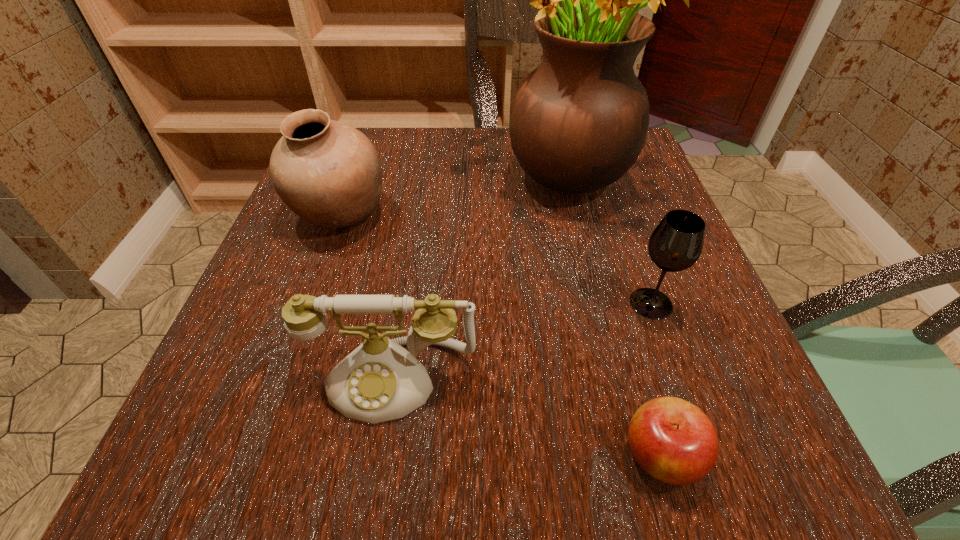
Find the location of a particular element. This screenshot has width=960, height=540. free space between the shortest object and the telephone is located at coordinates (526, 417).

Where is `vacant area that lies between the telephone and the wineglass`? Image resolution: width=960 pixels, height=540 pixels. vacant area that lies between the telephone and the wineglass is located at coordinates (521, 341).

Point out which object is positioned as the nearest to the tallest object. Please provide its 2D coordinates. Your answer should be formatted as a tuple, i.e. [(x, y)], where the tuple contains the x and y coordinates of a point satisfying the conditions above.

[(327, 172)]

Locate which object ranks fourth in proximity to the pottery. Please provide its 2D coordinates. Your answer should be formatted as a tuple, i.e. [(x, y)], where the tuple contains the x and y coordinates of a point satisfying the conditions above.

[(674, 441)]

Where is `vacant area that satisfies the following two spatial constraints: 1. on the dial of the telephone; 2. on the left side of the shortest object`? This screenshot has height=540, width=960. vacant area that satisfies the following two spatial constraints: 1. on the dial of the telephone; 2. on the left side of the shortest object is located at coordinates (379, 456).